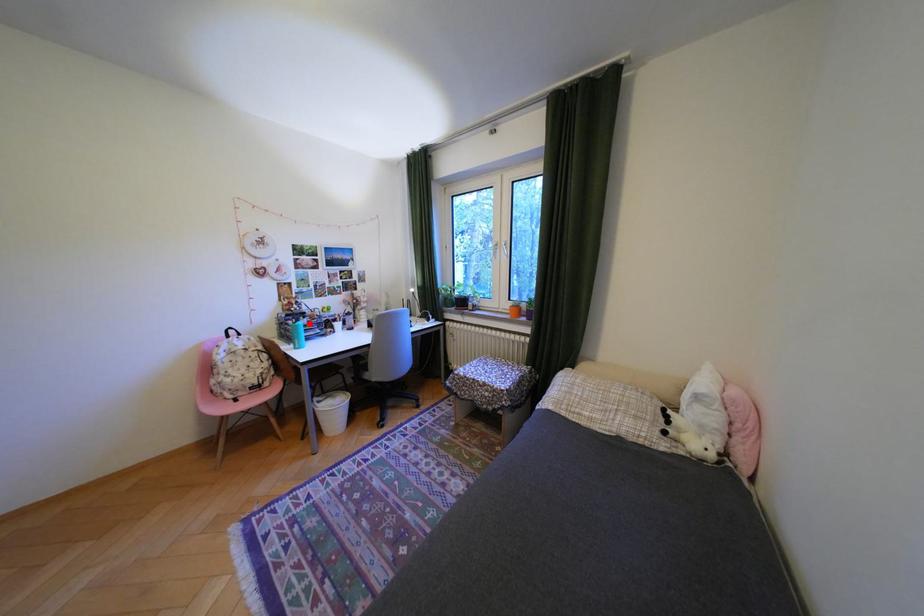
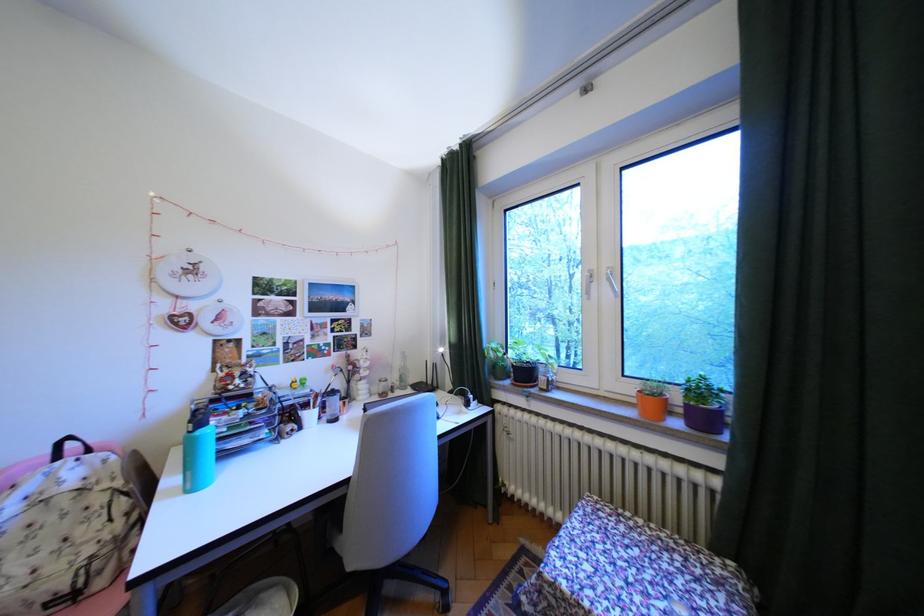
Locate, in the second image, the point that corresponds to the highlighted location in the first image.

(212, 432)